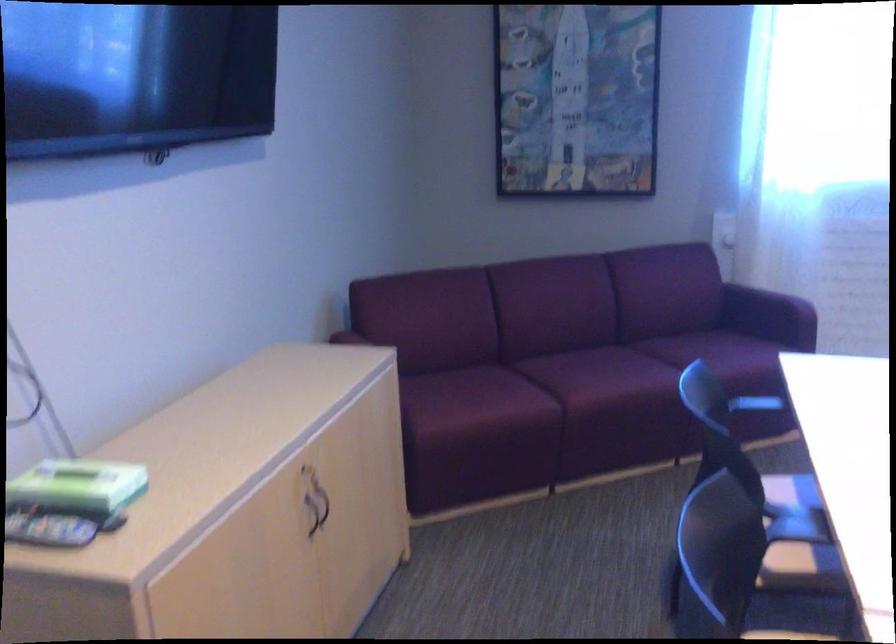
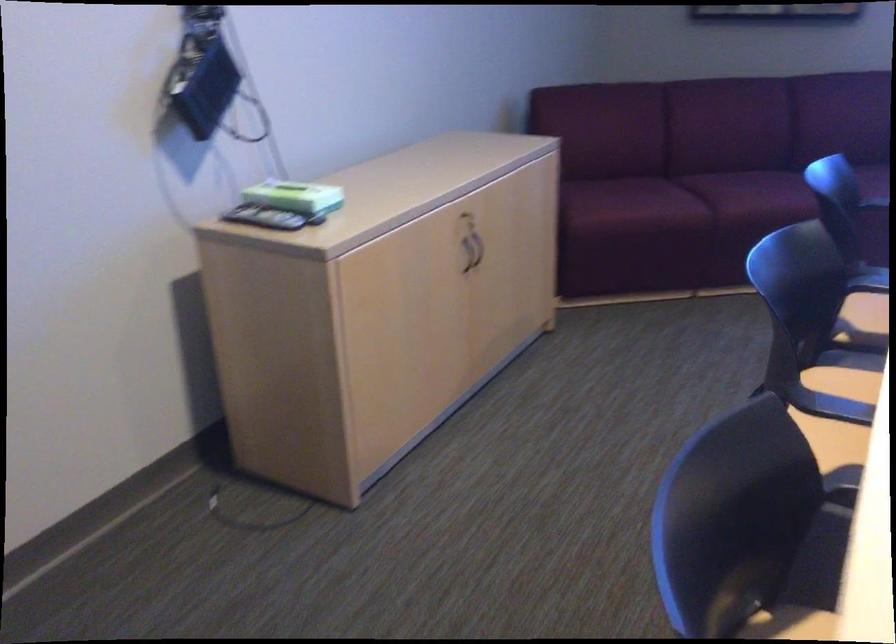
Locate, in the second image, the point that corresponds to point 71,491 in the first image.

(287, 196)